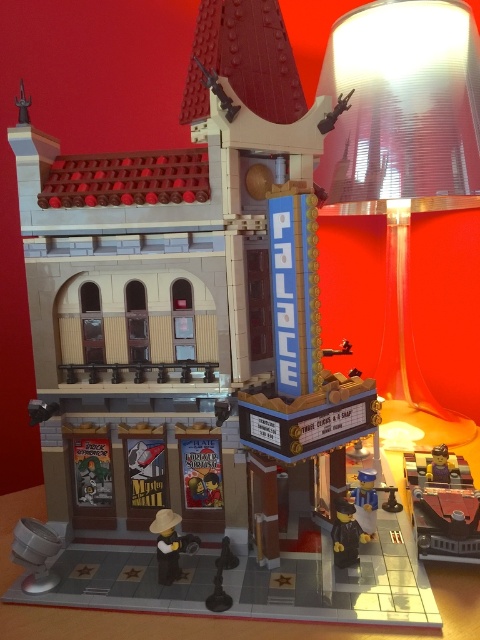
You are a LEGO minifigure standing at the entrance of the Palace theater. You want to get to your metallic gold car at lower right. Which direction should you walk to reach it?

The metallic gold car at lower right is located at point (443, 506), so you should walk towards the lower right direction to reach it.

You are a LEGO minifigure trying to reach the metallic gold car at lower right from your current position near the brick minifigure at center. Can you walk directly to the car without moving any other LEGO pieces?

The metallic gold car at lower right is 2.38 inches away from the brick minifigure at center. Since there are no other LEGO pieces mentioned in the scene blocking the path, you can walk directly to the car.